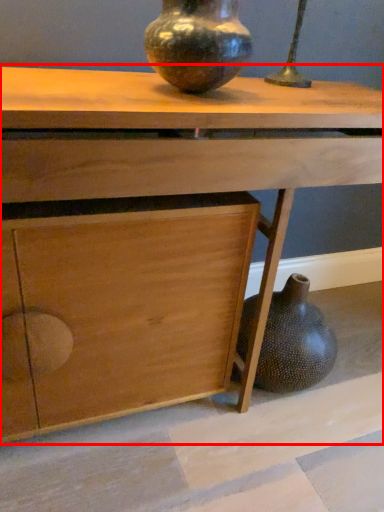
Question: In this image, where is table (annotated by the red box) located relative to vase?

Choices:
 (A) left
 (B) right

Answer: (B)